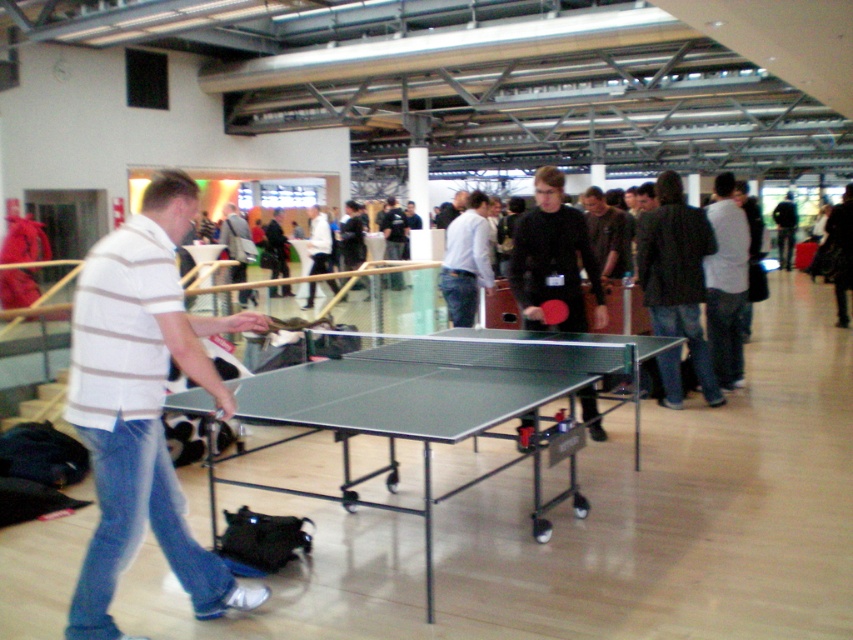
You are observing a table tennis match between two players. You notice the white striped shirt at left and the striped cotton shirt at center. Which player is shorter?

The white striped shirt at left is not as tall as striped cotton shirt at center, so the player wearing the white striped shirt at left is shorter.

You are organizing a table tennis tournament and need to ensure all tables meet the standard size requirements. Given the scene described, can you confirm if the green rubber table at center meets the standard size based on its comparison with the striped cotton shirt at center?

The green rubber table at center is smaller than the striped cotton shirt at center, so it does not meet the standard size requirement for table tennis tables.

You are standing at point A located at coordinates (142,404) in the image. Looking around, you notice a white striped shirt at left. What is the nearest object to your current position?

The nearest object to your current position at point A is the white striped shirt at left, as it is located at the specified coordinates.